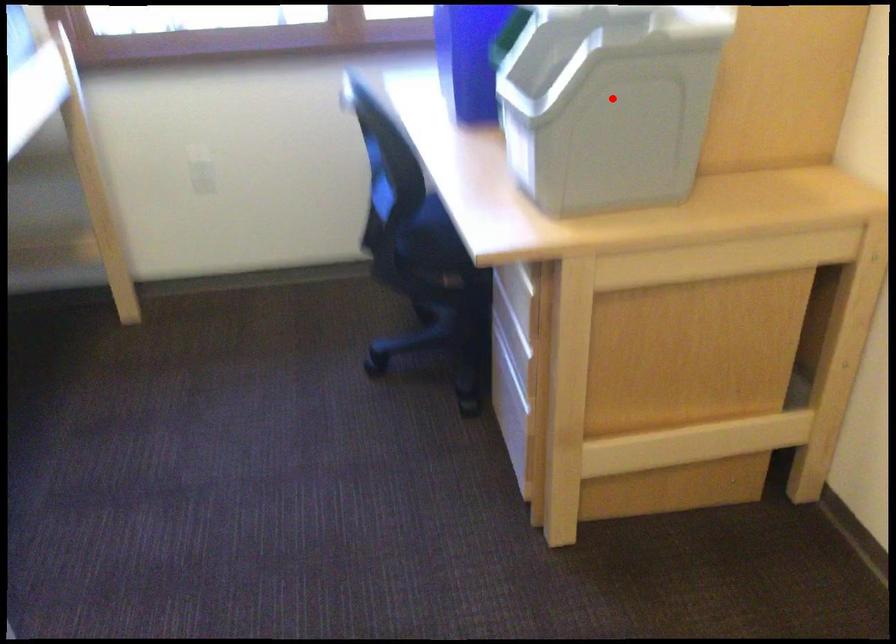
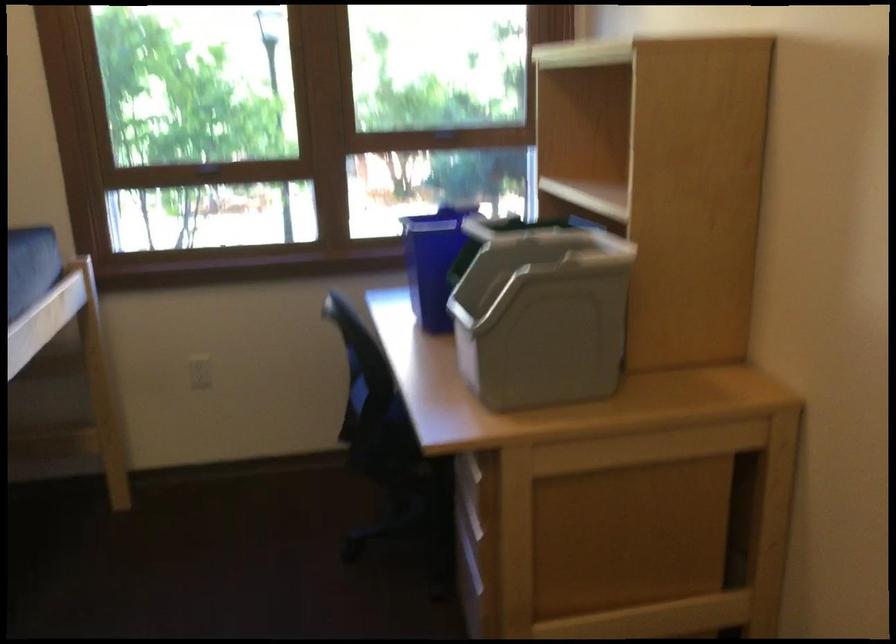
Question: I am providing you with two images of the same scene from different viewpoints. A red point is shown in image1. For the corresponding object point in image2, is it positioned nearer or farther from the camera?

Choices:
 (A) Nearer
 (B) Farther

Answer: (B)